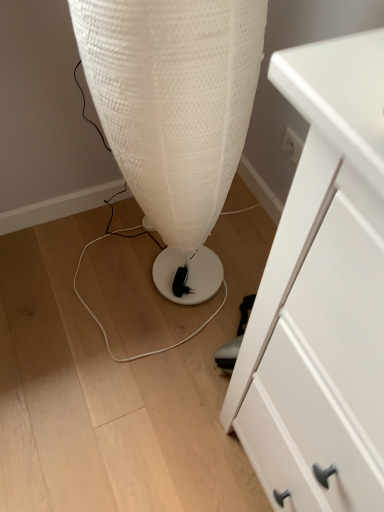
Find the location of `vacant location below white mesh lamp at center (from a real-world perspective)`. vacant location below white mesh lamp at center (from a real-world perspective) is located at coordinates (150, 284).